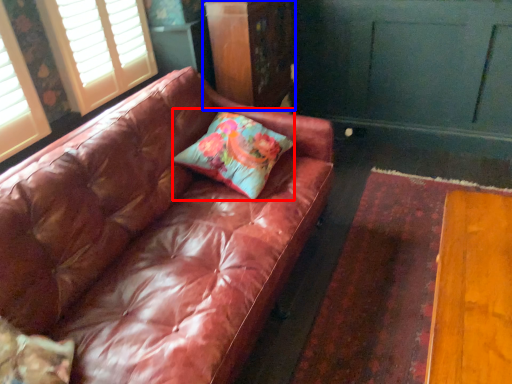
Question: Which object is closer to the camera taking this photo, pillow (highlighted by a red box) or dresser (highlighted by a blue box)?

Choices:
 (A) pillow
 (B) dresser

Answer: (A)